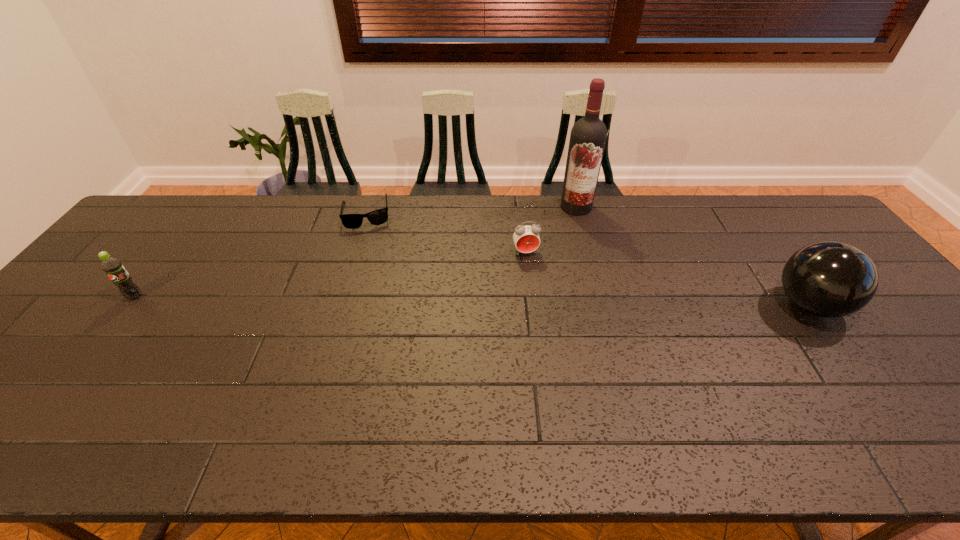
Find the location of `object that is the third closest one to the third shortest object`. object that is the third closest one to the third shortest object is located at coordinates (588, 136).

I want to click on vacant space that satisfies the following two spatial constraints: 1. on the front label of the leftmost object; 2. on the surface of the fourth shortest object near the finger holes, so click(129, 305).

The width and height of the screenshot is (960, 540). Find the location of `vacant position in the image that satisfies the following two spatial constraints: 1. on the front side of the bowling ball; 2. on the surface of the fourth tallest object near the finger holes`. vacant position in the image that satisfies the following two spatial constraints: 1. on the front side of the bowling ball; 2. on the surface of the fourth tallest object near the finger holes is located at coordinates (531, 305).

Find the location of a particular element. This screenshot has height=540, width=960. blank space that satisfies the following two spatial constraints: 1. on the front label of the soda; 2. on the surface of the second tallest object near the finger holes is located at coordinates (129, 305).